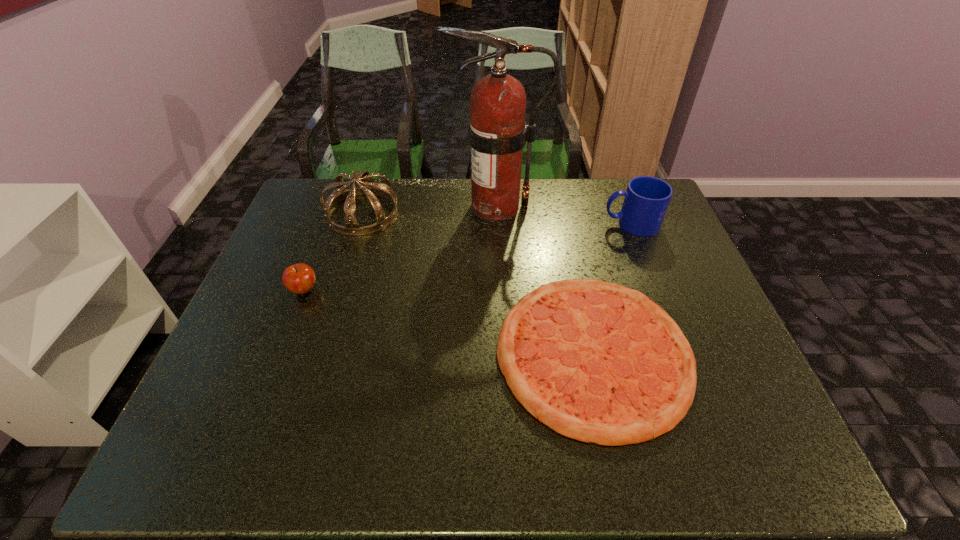
The width and height of the screenshot is (960, 540). In order to click on fire extinguisher in this screenshot , I will do `click(497, 131)`.

Locate an element on the screen. tiara is located at coordinates (367, 187).

The width and height of the screenshot is (960, 540). In order to click on mug in this screenshot , I will do `click(646, 200)`.

I want to click on apple, so click(x=299, y=278).

Identify the location of the shortest object. Image resolution: width=960 pixels, height=540 pixels. (598, 362).

Identify the location of vacant area situated at the nozzle of the tallest object. (372, 206).

Where is `vacant area located 0.280m at the nozzle of the tallest object`? The width and height of the screenshot is (960, 540). vacant area located 0.280m at the nozzle of the tallest object is located at coordinates (362, 206).

You are a GUI agent. You are given a task and a screenshot of the screen. Output one action in this format:
    pyautogui.click(x=<x>, y=<y>)
    Task: Click on the vacant region located 0.160m at the nozzle of the tallest object
    This screenshot has width=960, height=540.
    Given the screenshot: What is the action you would take?
    pyautogui.click(x=399, y=206)

At what (x,y) coordinates should I click in order to perform the action: click on vacant position located 0.350m on the front of the fourth shortest object. Please return your answer as a coordinate pair (x, y). Image resolution: width=960 pixels, height=540 pixels. Looking at the image, I should click on (325, 330).

The height and width of the screenshot is (540, 960). Identify the location of vacant space located on the side with the handle of the third shortest object. (502, 224).